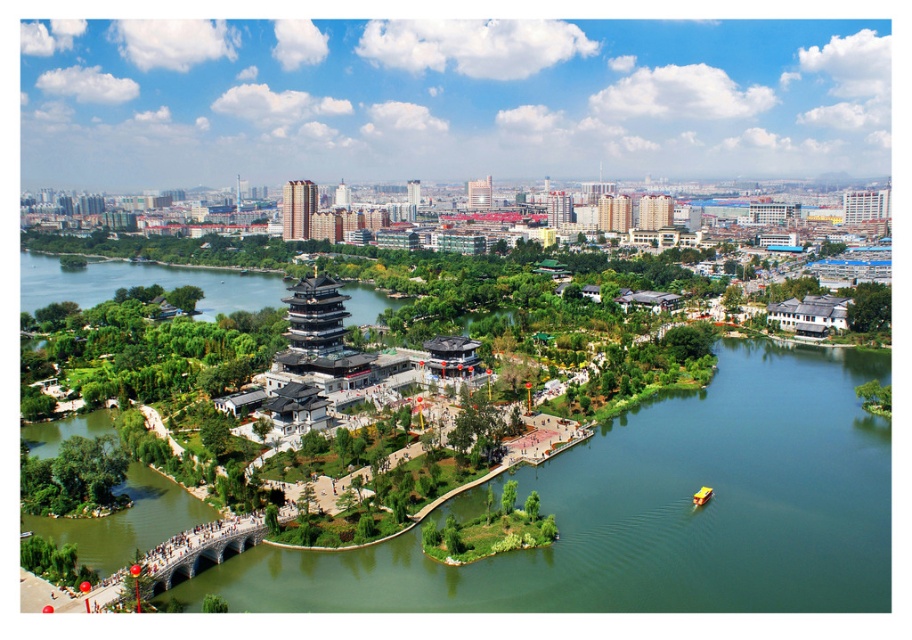
Can you confirm if green water at center is bigger than yellow plastic boat at lower right?

Yes.

Find the location of `green water at center`. green water at center is located at coordinates (656, 513).

Image resolution: width=912 pixels, height=640 pixels. I want to click on green water at center, so click(656, 513).